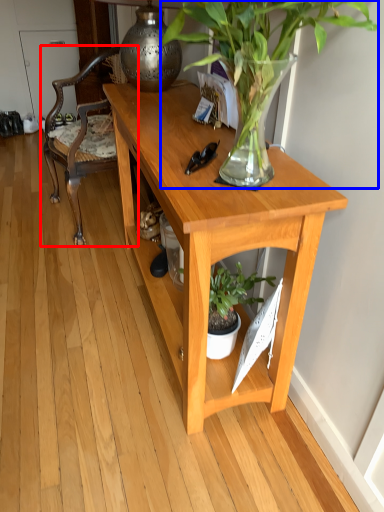
Question: Which object is closer to the camera taking this photo, chair (highlighted by a red box) or houseplant (highlighted by a blue box)?

Choices:
 (A) chair
 (B) houseplant

Answer: (B)